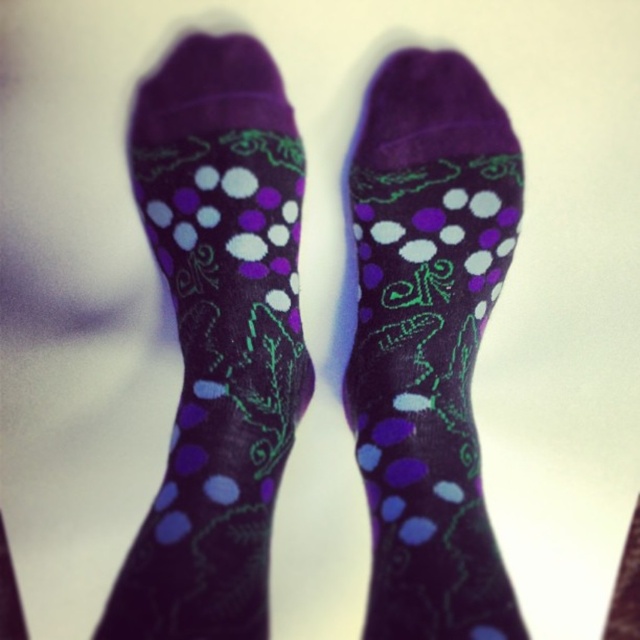
You are looking at the socks and want to know if the point at coordinate (252, 392) is closer to you than the point at (472, 480). Can you determine this based on the image?

Yes, the point at coordinate (252, 392) is closer to you than the point at (472, 480) because it is further to the viewer according to the description.

You are trying to determine the order of the socks on your feet based on the image. Which sock is on top, the purple dotted socks at center or the purple matte socks at center?

The purple dotted socks at center is positioned over the purple matte socks at center, so the purple dotted socks at center is on top.

You are trying to choose between two pairs of socks displayed on a plain light floor. The purple dotted socks at center have a thinner design compared to the purple matte socks at center. Which pair would you recommend if someone prefers a more snug fit?

The purple dotted socks at center are thinner than the purple matte socks at center, so the purple dotted socks at center would provide a more snug fit due to their thinner material.